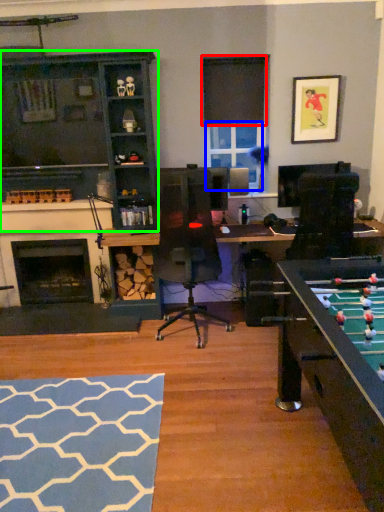
Question: Based on their relative distances, which object is nearer to curtain (highlighted by a red box)? Choose from window screen (highlighted by a blue box) and cabinetry (highlighted by a green box).

Choices:
 (A) window screen
 (B) cabinetry

Answer: (A)